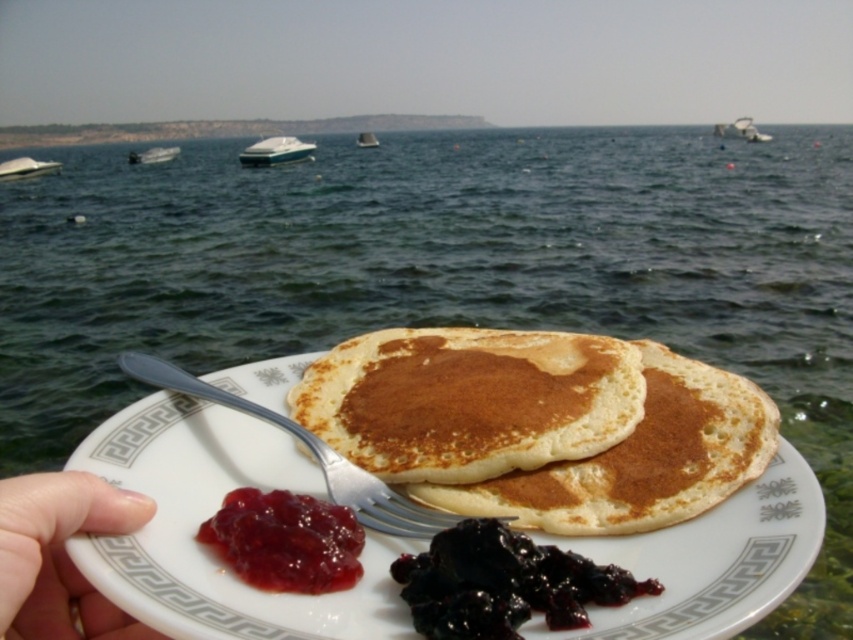
Question: Which object is closer to the camera taking this photo?

Choices:
 (A) white plastic boat at left
 (B) shiny red jam at center
 (C) white plastic boat at upper left

Answer: (B)

Question: Which object is closer to the camera taking this photo?

Choices:
 (A) white plastic boat at upper right
 (B) white plastic boat at center

Answer: (B)

Question: Can you confirm if silver metallic fork at lower center is positioned below white plastic boat at left?

Choices:
 (A) no
 (B) yes

Answer: (B)

Question: Which object appears farthest from the camera in this image?

Choices:
 (A) white plastic boat at upper left
 (B) white plastic boat at left
 (C) golden brown pancake at center

Answer: (A)

Question: Can you confirm if white plastic boat at upper left is wider than white plastic boat at center?

Choices:
 (A) yes
 (B) no

Answer: (A)

Question: Is white plastic boat at left positioned before white plastic boat at upper left?

Choices:
 (A) no
 (B) yes

Answer: (B)